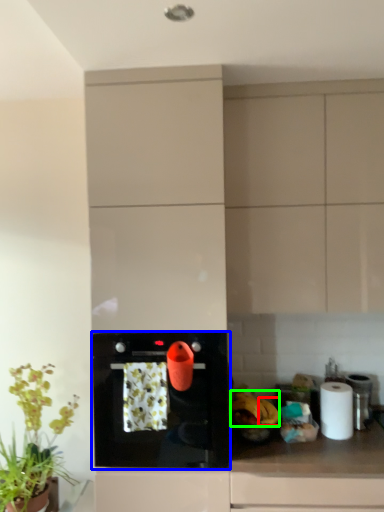
Question: Based on their relative distances, which object is nearer to banana (highlighted by a red box)? Choose from kitchen appliance (highlighted by a blue box) and banana (highlighted by a green box).

Choices:
 (A) kitchen appliance
 (B) banana

Answer: (B)